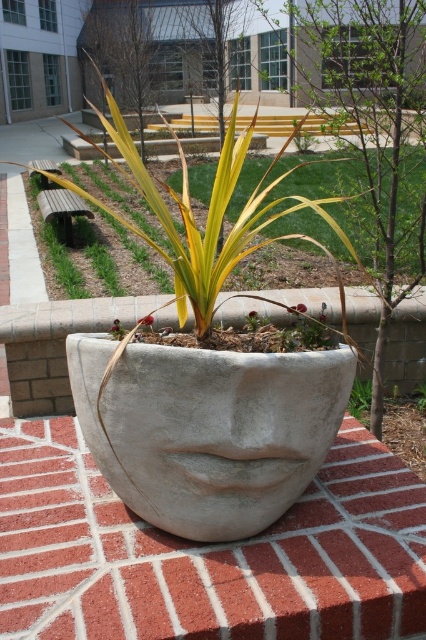
In order to click on white concrete face at center in this screenshot , I will do `click(206, 552)`.

Is point (71, 573) positioned in front of point (92, 317)?

That is True.

Where is `white concrete face at center`? This screenshot has height=640, width=426. white concrete face at center is located at coordinates (206, 552).